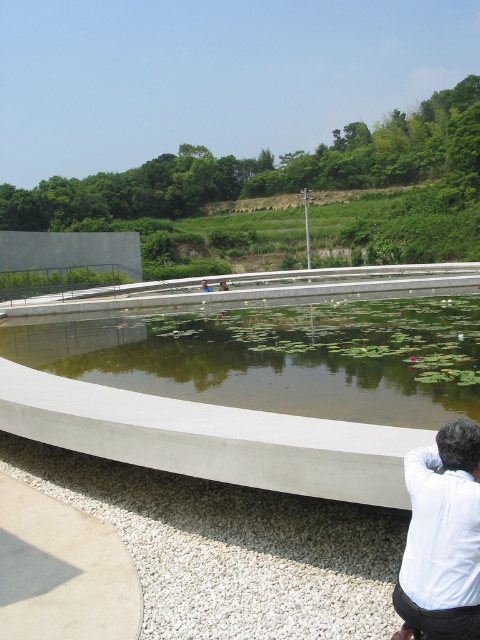
Is green concrete pond at center shorter than white matte shirt at lower right?

No.

Is green concrete pond at center to the right of white matte shirt at lower right from the viewer's perspective?

Correct, you'll find green concrete pond at center to the right of white matte shirt at lower right.

Image resolution: width=480 pixels, height=640 pixels. What do you see at coordinates (279, 356) in the screenshot?
I see `green concrete pond at center` at bounding box center [279, 356].

Where is `green concrete pond at center`? This screenshot has width=480, height=640. green concrete pond at center is located at coordinates (279, 356).